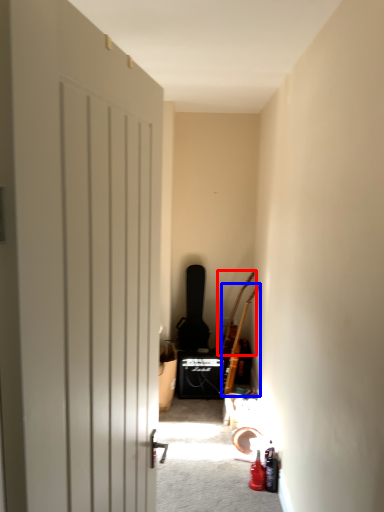
Question: Among these objects, which one is farthest to the camera, guitar (highlighted by a red box) or guitar (highlighted by a blue box)?

Choices:
 (A) guitar
 (B) guitar

Answer: (A)